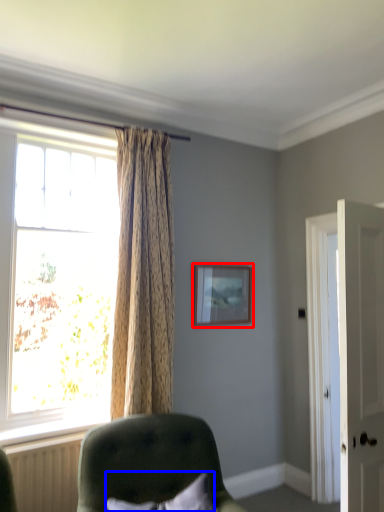
Question: Which point is further to the camera, picture frame (highlighted by a red box) or pillow (highlighted by a blue box)?

Choices:
 (A) picture frame
 (B) pillow

Answer: (A)